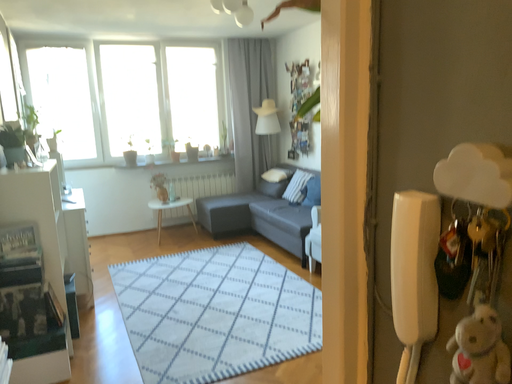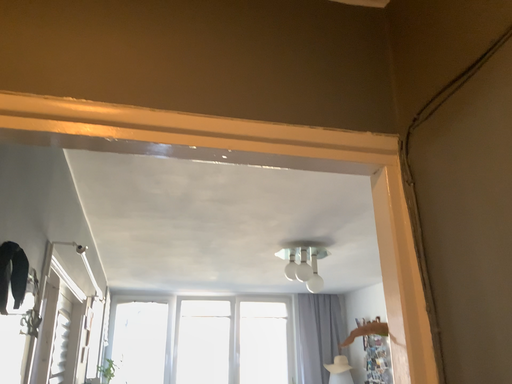
Question: Which way did the camera rotate in the video?

Choices:
 (A) rotated downward
 (B) rotated upward

Answer: (B)